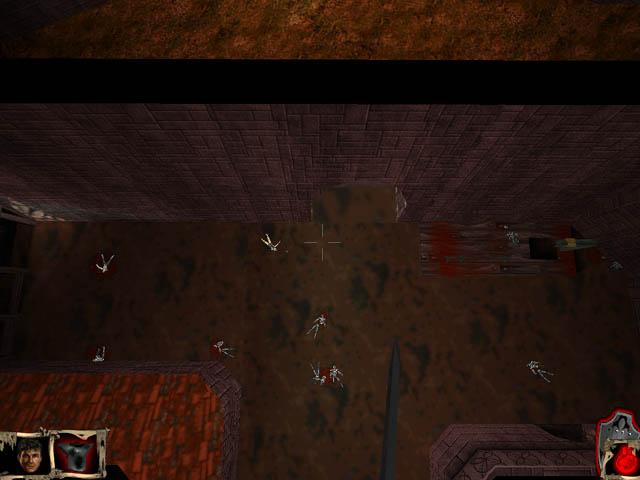
I want to click on wall, so click(292, 159).